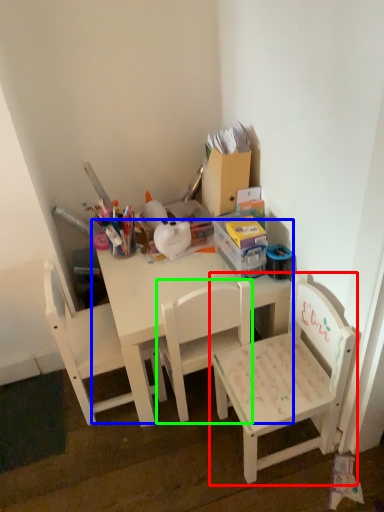
Question: Estimate the real-world distances between objects in this image. Which object is farther from chair (highlighted by a red box), table (highlighted by a blue box) or chair (highlighted by a green box)?

Choices:
 (A) table
 (B) chair

Answer: (A)